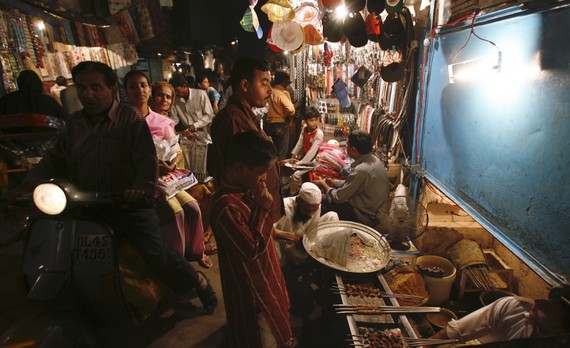
Where is `fabric`? The image size is (570, 348). fabric is located at coordinates (96, 42).